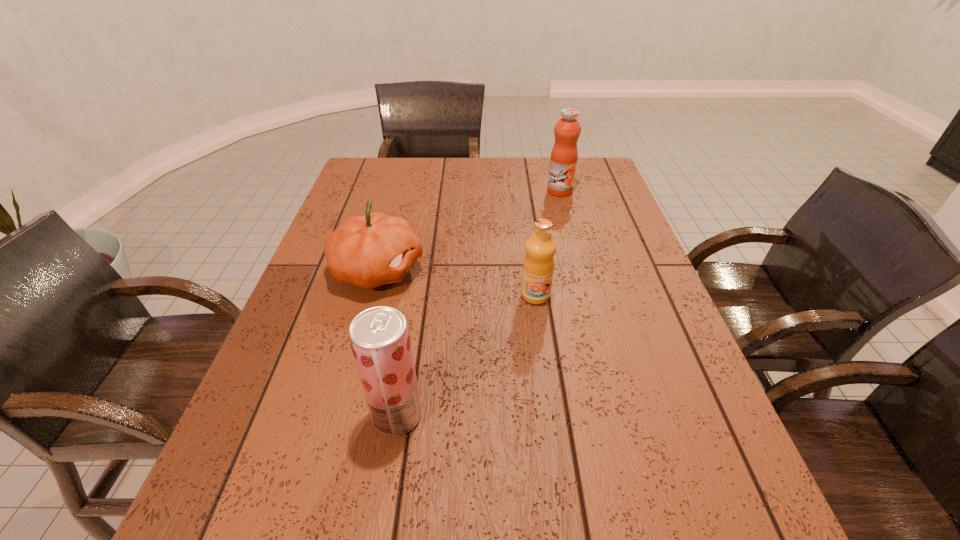
Find the location of `blank region between the pumpkin and the second fruit juice from left to right`. blank region between the pumpkin and the second fruit juice from left to right is located at coordinates (457, 283).

What are the coordinates of `vacant area that lies between the second nearest fruit juice and the pumpkin` in the screenshot? It's located at [x=457, y=283].

In order to click on free spot between the pumpkin and the rightmost fruit juice in this screenshot , I will do `click(468, 231)`.

Identify the location of free space between the pumpkin and the farthest fruit juice. tap(468, 231).

Where is `free space between the farthest fruit juice and the pumpkin`? The image size is (960, 540). free space between the farthest fruit juice and the pumpkin is located at coordinates (468, 231).

Choose which object is the third nearest neighbor to the second farthest fruit juice. Please provide its 2D coordinates. Your answer should be formatted as a tuple, i.e. [(x, y)], where the tuple contains the x and y coordinates of a point satisfying the conditions above.

[(563, 162)]

Locate which object is the second closest to the leftmost fruit juice. Please provide its 2D coordinates. Your answer should be formatted as a tuple, i.e. [(x, y)], where the tuple contains the x and y coordinates of a point satisfying the conditions above.

[(538, 266)]

Identify which fruit juice is the second nearest to the shortest fruit juice. Please provide its 2D coordinates. Your answer should be formatted as a tuple, i.e. [(x, y)], where the tuple contains the x and y coordinates of a point satisfying the conditions above.

[(563, 162)]

Locate an element on the screen. Image resolution: width=960 pixels, height=540 pixels. fruit juice that can be found as the second closest to the leftmost fruit juice is located at coordinates (563, 162).

Identify the location of free spot that satisfies the following two spatial constraints: 1. on the front face of the pumpkin; 2. on the back side of the leftmost fruit juice. Image resolution: width=960 pixels, height=540 pixels. (338, 415).